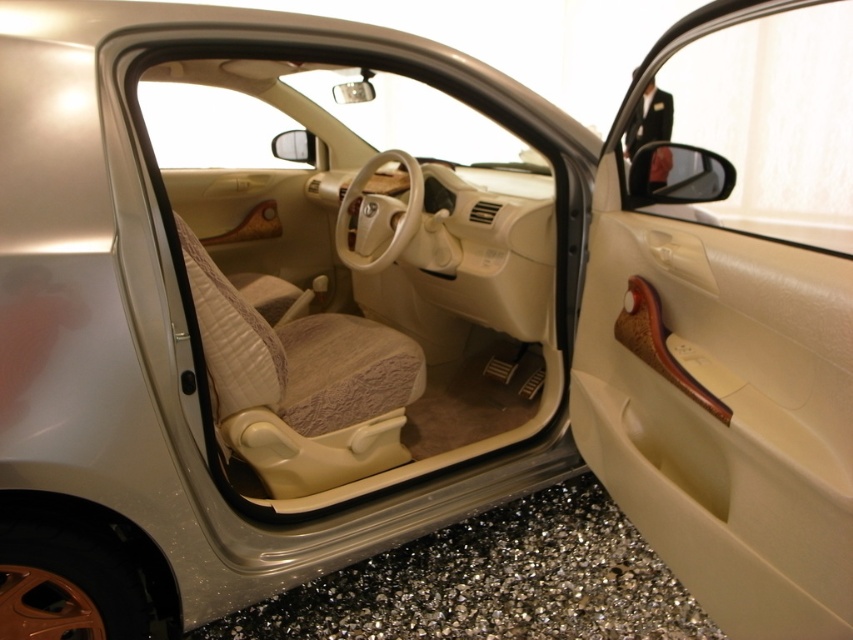
You are sitting in the driver seat of the car and want to reach the wooden handle at center. Which direction should you move your hand from the beige fabric door at center to reach it?

The beige fabric door at center is to the left of the wooden handle at center. So to reach the wooden handle at center, you should move your hand to the right from the beige fabric door at center.

You are a passenger entering the car and need to close the driver side door. Which object should you grab to close the door? The beige fabric door at center or the wooden handle at center?

You should grab the wooden handle at center to close the door because the beige fabric door at center is positioned under the wooden handle at center, meaning the handle is the part you can grasp to operate the door.